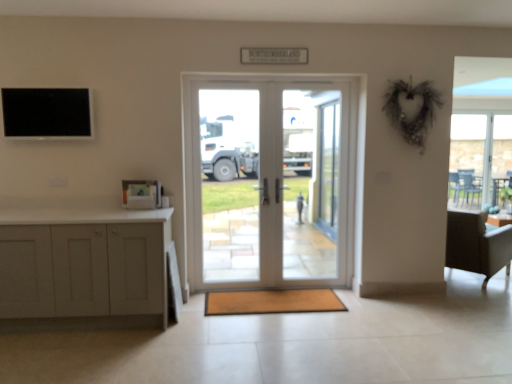
Question: Is black matte screen at upper left outside white matte cabinet at left?

Choices:
 (A) yes
 (B) no

Answer: (A)

Question: Would you say black matte screen at upper left contains white matte cabinet at left?

Choices:
 (A) yes
 (B) no

Answer: (B)

Question: Considering the relative sizes of black matte screen at upper left and white matte cabinet at left in the image provided, is black matte screen at upper left bigger than white matte cabinet at left?

Choices:
 (A) yes
 (B) no

Answer: (B)

Question: Is black matte screen at upper left next to white matte cabinet at left?

Choices:
 (A) yes
 (B) no

Answer: (B)

Question: Can you confirm if black matte screen at upper left is wider than white matte cabinet at left?

Choices:
 (A) no
 (B) yes

Answer: (A)

Question: Is black matte screen at upper left oriented away from white matte cabinet at left?

Choices:
 (A) yes
 (B) no

Answer: (B)

Question: Considering the relative positions of transparent glass door at center, arranged as the 1th screen door when viewed from the front, and clear glass screen door at center, the first screen door from the back, in the image provided, is transparent glass door at center, arranged as the 1th screen door when viewed from the front, behind clear glass screen door at center, the first screen door from the back,?

Choices:
 (A) no
 (B) yes

Answer: (A)

Question: Is transparent glass door at center, which ranks as the 2th screen door in right-to-left order, at the left side of clear glass screen door at center, the first screen door from the back?

Choices:
 (A) yes
 (B) no

Answer: (A)

Question: Is transparent glass door at center, arranged as the second screen door when viewed from the back, to the right of clear glass screen door at center, which ranks as the second screen door in front-to-back order, from the viewer's perspective?

Choices:
 (A) no
 (B) yes

Answer: (A)

Question: From a real-world perspective, is transparent glass door at center, arranged as the second screen door when viewed from the back, over clear glass screen door at center, which ranks as the 2th screen door in left-to-right order?

Choices:
 (A) yes
 (B) no

Answer: (B)

Question: Considering the relative positions of transparent glass door at center, the first screen door in the left-to-right sequence, and clear glass screen door at center, which is the 1th screen door in right-to-left order, in the image provided, is transparent glass door at center, the first screen door in the left-to-right sequence, in front of clear glass screen door at center, which is the 1th screen door in right-to-left order,?

Choices:
 (A) no
 (B) yes

Answer: (B)

Question: Is transparent glass door at center, arranged as the second screen door when viewed from the back, smaller than clear glass screen door at center, which ranks as the second screen door in front-to-back order?

Choices:
 (A) no
 (B) yes

Answer: (B)

Question: Is transparent glass table at right at the left side of brown textured mat at center?

Choices:
 (A) yes
 (B) no

Answer: (B)